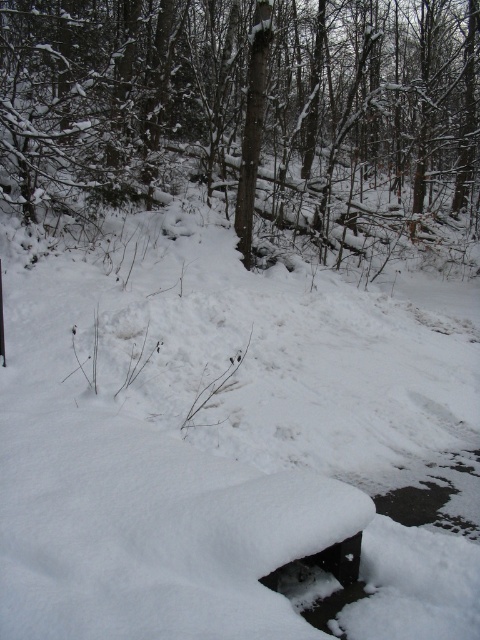
Which of these two, white fluffy snow at center or smooth brown tree trunk at center, stands shorter?

Standing shorter between the two is white fluffy snow at center.

Between white fluffy snow at center and smooth brown tree trunk at center, which one is positioned lower?

A: Positioned lower is white fluffy snow at center.

What are the coordinates of `white fluffy snow at center` in the screenshot? It's located at (224, 440).

Where is `white fluffy snow at center`? white fluffy snow at center is located at coordinates (224, 440).